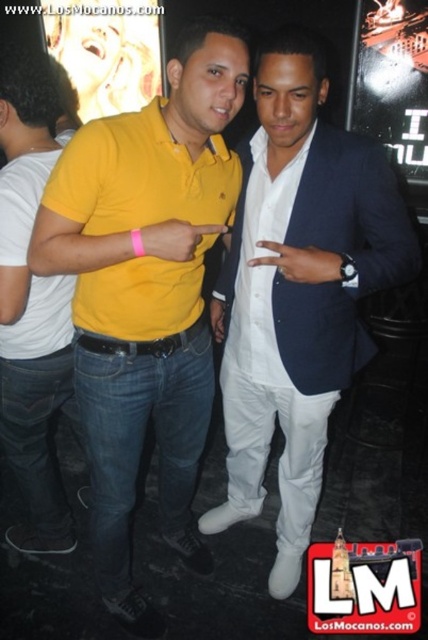
Does matte yellow polo shirt at center have a larger size compared to matte yellow polo shirt at left?

Yes.

Between matte yellow polo shirt at center and matte yellow polo shirt at left, which one appears on the right side from the viewer's perspective?

matte yellow polo shirt at center is more to the right.

Between point (124, 156) and point (5, 358), which one is positioned in front?

Point (124, 156)

The image size is (428, 640). What are the coordinates of `matte yellow polo shirt at center` in the screenshot? It's located at (145, 292).

Which is more to the left, matte yellow polo shirt at left or white satin shirt at center?

From the viewer's perspective, matte yellow polo shirt at left appears more on the left side.

Consider the image. Between matte yellow polo shirt at left and white satin shirt at center, which one has less height?

white satin shirt at center is shorter.

Does point (12, 140) come in front of point (258, 301)?

No.

This screenshot has width=428, height=640. What are the coordinates of `matte yellow polo shirt at left` in the screenshot? It's located at point(32,307).

Who is positioned more to the left, matte yellow polo shirt at center or white satin suit at center?

Positioned to the left is matte yellow polo shirt at center.

Who is positioned more to the right, matte yellow polo shirt at center or white satin suit at center?

white satin suit at center

This screenshot has width=428, height=640. In order to click on matte yellow polo shirt at center in this screenshot , I will do `click(145, 292)`.

At what (x,y) coordinates should I click in order to perform the action: click on matte yellow polo shirt at center. Please return your answer as a coordinate pair (x, y). Looking at the image, I should click on (145, 292).